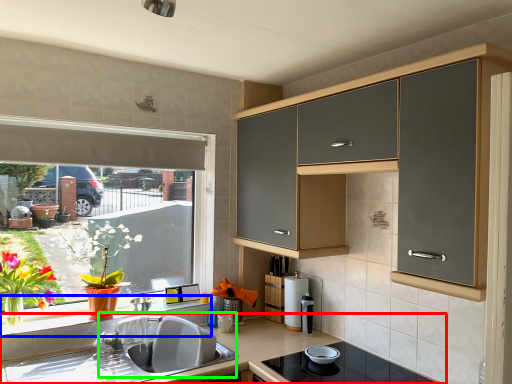
Question: Which object is the farthest from countertop (highlighted by a red box)? Choose among these: window sill (highlighted by a blue box) or sink (highlighted by a green box).

Choices:
 (A) window sill
 (B) sink

Answer: (A)